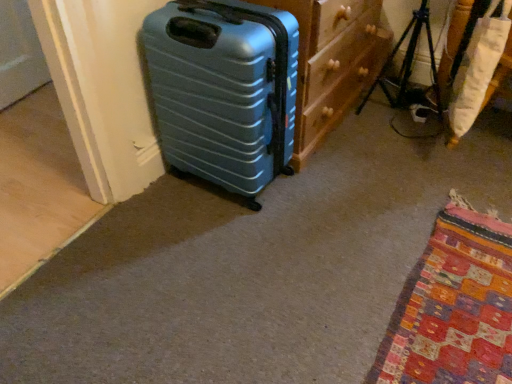
Question: Does metallic tripod at center right appear on the right side of wooden dresser at center?

Choices:
 (A) yes
 (B) no

Answer: (A)

Question: Is metallic tripod at center right smaller than wooden dresser at center?

Choices:
 (A) no
 (B) yes

Answer: (B)

Question: Is metallic tripod at center right not near wooden dresser at center?

Choices:
 (A) no
 (B) yes

Answer: (A)

Question: Can we say metallic tripod at center right lies outside wooden dresser at center?

Choices:
 (A) no
 (B) yes

Answer: (B)

Question: Is metallic tripod at center right positioned with its back to wooden dresser at center?

Choices:
 (A) yes
 (B) no

Answer: (A)

Question: In terms of width, does teal plastic suitcase at left look wider or thinner when compared to metallic tripod at center right?

Choices:
 (A) thin
 (B) wide

Answer: (B)

Question: From a real-world perspective, relative to metallic tripod at center right, is teal plastic suitcase at left vertically above or below?

Choices:
 (A) above
 (B) below

Answer: (A)

Question: In the image, is teal plastic suitcase at left positioned in front of or behind metallic tripod at center right?

Choices:
 (A) behind
 (B) front

Answer: (B)

Question: Based on their positions, is teal plastic suitcase at left located to the left or right of metallic tripod at center right?

Choices:
 (A) left
 (B) right

Answer: (A)

Question: Visually, is teal plastic suitcase at left positioned to the left or to the right of white fabric cushion at right?

Choices:
 (A) left
 (B) right

Answer: (A)

Question: In terms of height, does teal plastic suitcase at left look taller or shorter compared to white fabric cushion at right?

Choices:
 (A) tall
 (B) short

Answer: (A)

Question: Relative to white fabric cushion at right, is teal plastic suitcase at left in front or behind?

Choices:
 (A) behind
 (B) front

Answer: (B)

Question: Considering the positions of point (252, 82) and point (465, 102), is point (252, 82) closer or farther from the camera than point (465, 102)?

Choices:
 (A) closer
 (B) farther

Answer: (A)

Question: From a real-world perspective, is wooden dresser at center positioned above or below white fabric cushion at right?

Choices:
 (A) below
 (B) above

Answer: (A)

Question: Looking at the image, does wooden dresser at center seem bigger or smaller compared to white fabric cushion at right?

Choices:
 (A) small
 (B) big

Answer: (B)